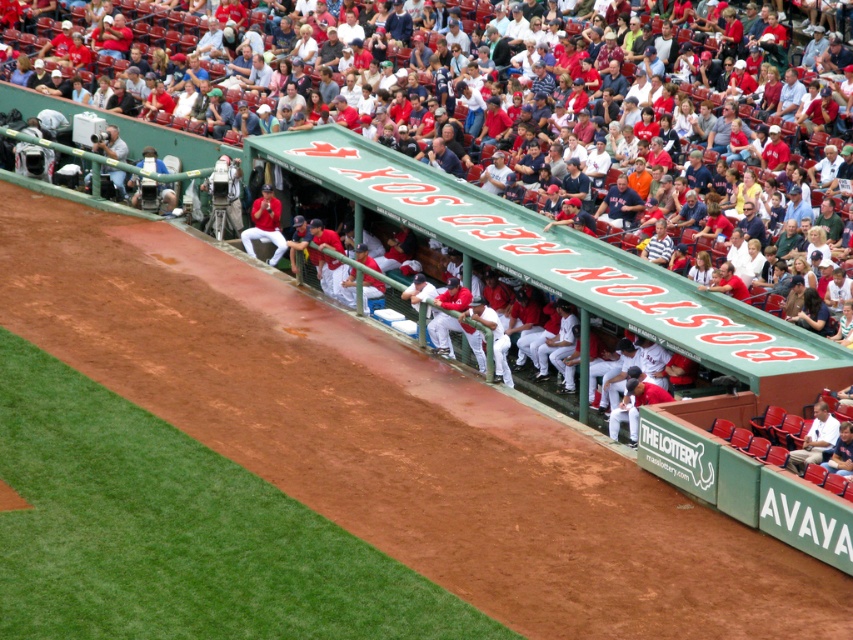
Which of these two, white plastic seats at upper center or red uniformed players at center, stands taller?

white plastic seats at upper center

Is white plastic seats at upper center further to camera compared to red uniformed players at center?

No.

Measure the distance between point [525,246] and camera.

Point [525,246] and camera are 86.31 feet apart.

The width and height of the screenshot is (853, 640). In order to click on white plastic seats at upper center in this screenshot , I will do `click(538, 250)`.